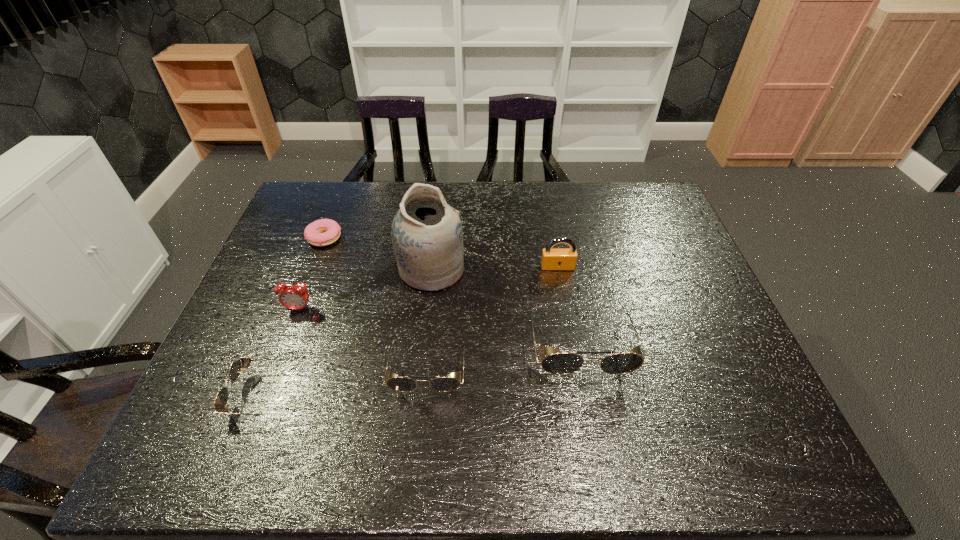
The image size is (960, 540). What are the coordinates of `vacant place for an extra sunglasses on the right` in the screenshot? It's located at (717, 324).